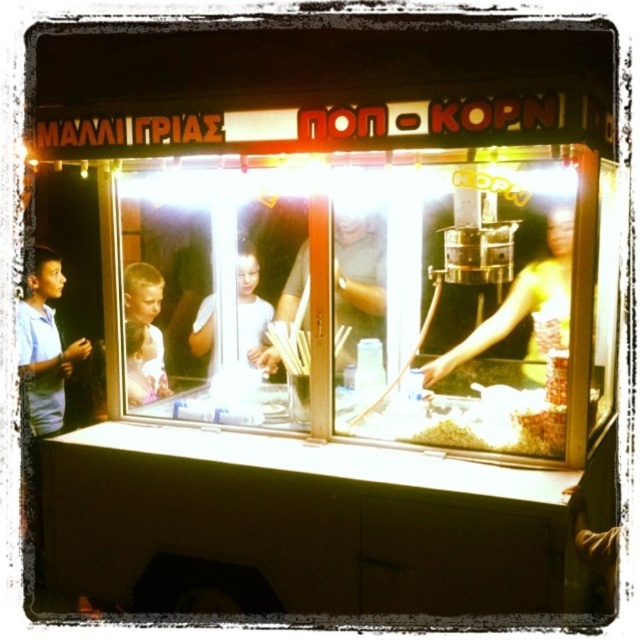
You are a customer at the popcorn stall and want to know if the distance between the white matte paper at center and the white glossy shirt at center is sufficient for you to safely place your popcorn order without touching either item. The minimum required distance for safety is 12 inches. Can you do so?

The distance between the white matte paper at center and the white glossy shirt at center is 11.62 inches, which is less than the required 12 inches for safety. Therefore, you cannot safely place your popcorn order without potentially touching one of the items.